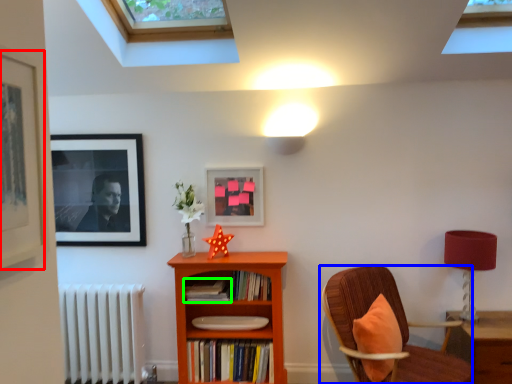
Question: Estimate the real-world distances between objects in this image. Which object is farther from picture frame (highlighted by a red box), chair (highlighted by a blue box) or book (highlighted by a green box)?

Choices:
 (A) chair
 (B) book

Answer: (A)